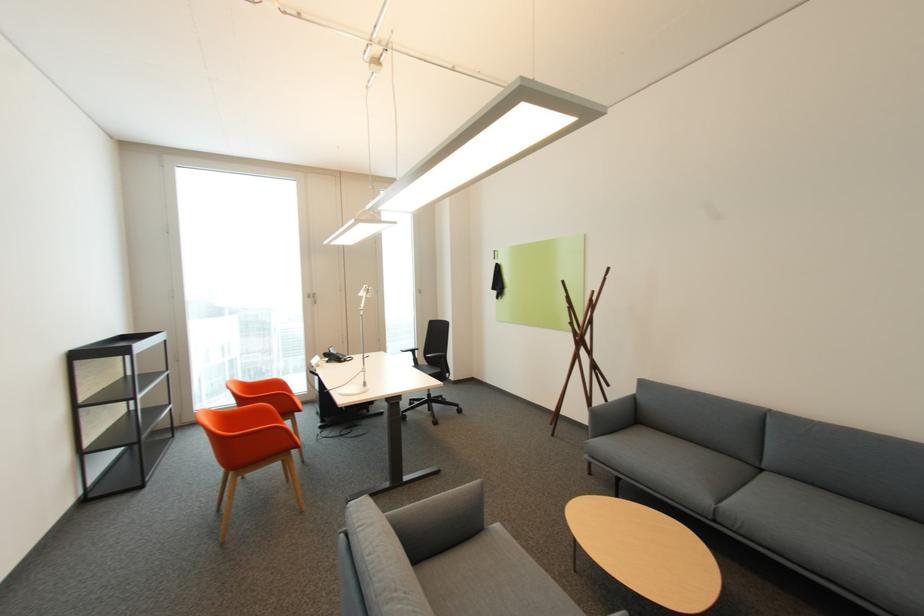
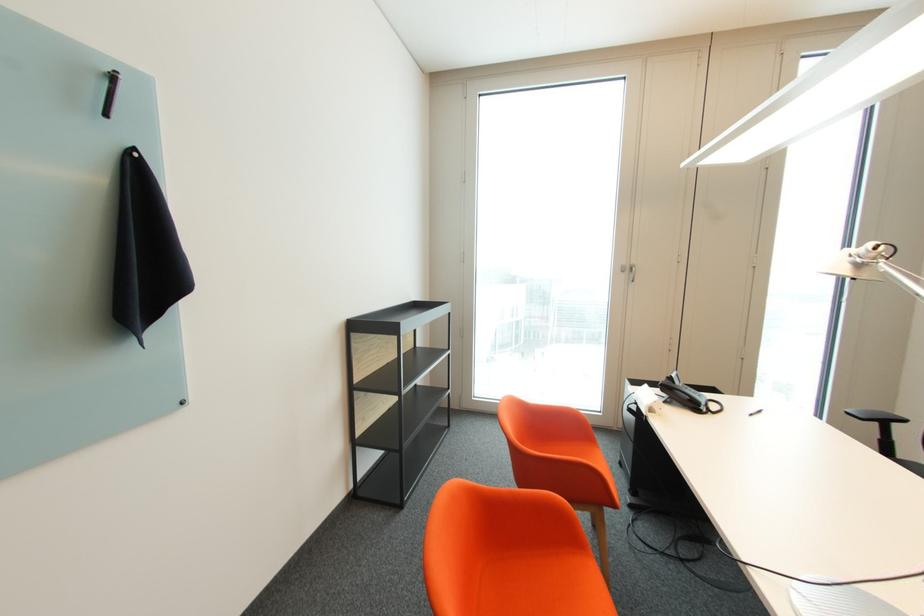
Where in the second image is the point corresponding to [314,297] from the first image?

(629, 272)